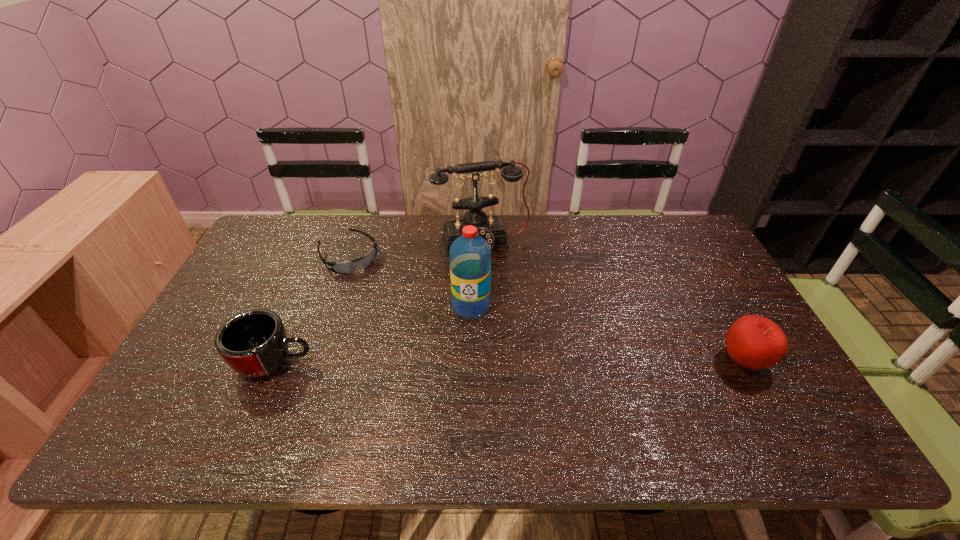
You are a GUI agent. You are given a task and a screenshot of the screen. Output one action in this format:
    pyautogui.click(x=<x>, y=<y>)
    Task: Click on the empty space that is in between the apple and the third nearest object
    This screenshot has height=540, width=960.
    Given the screenshot: What is the action you would take?
    pyautogui.click(x=608, y=333)

The height and width of the screenshot is (540, 960). Identify the location of blank region between the sunglasses and the telephone. (416, 249).

The height and width of the screenshot is (540, 960). In order to click on empty space that is in between the sunglasses and the telephone in this screenshot , I will do `click(416, 249)`.

Identify the location of free space that is in between the telephone and the mug. Image resolution: width=960 pixels, height=540 pixels. (378, 303).

I want to click on unoccupied area between the telephone and the apple, so click(613, 302).

Locate an element on the screen. vacant space that's between the rightmost object and the telephone is located at coordinates (613, 302).

Identify the location of free spot between the water bottle and the shortest object. (410, 281).

Find the location of a particular element. This screenshot has width=960, height=540. vacant space that is in between the sunglasses and the water bottle is located at coordinates (410, 281).

Identify the location of free point between the shortest object and the telephone. (416, 249).

Where is `free spot between the mug and the telephone`? free spot between the mug and the telephone is located at coordinates (378, 303).